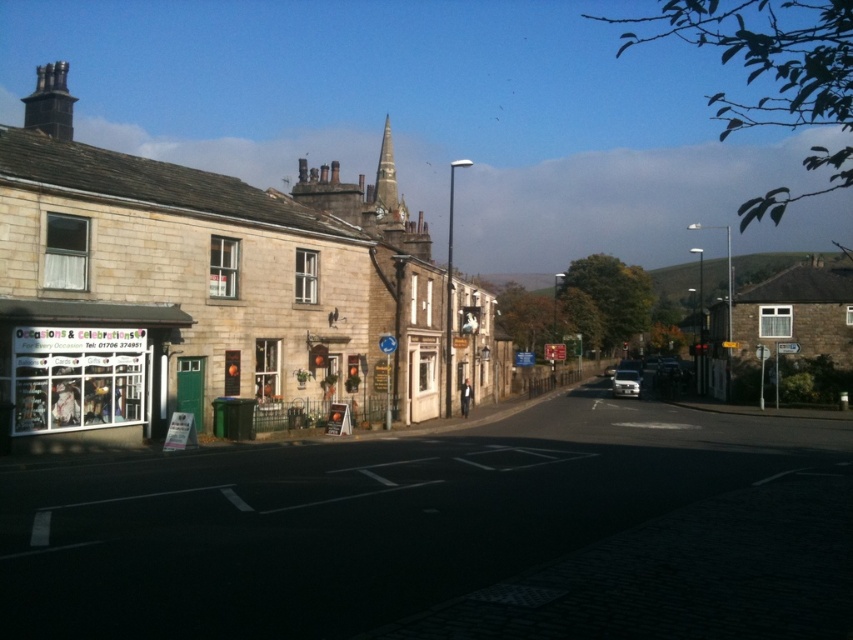
You are a delivery person who needs to deliver a package to the stone building at left. The package is too big to fit through the matte glass window at left. Can you deliver it through the main entrance instead?

The stone building at left is larger in size than the matte glass window at left, so the main entrance is likely large enough to accommodate the oversized package.

You are a delivery person trying to deliver a package to the shop with the green door. You see the stone building at left and the matte glass window at left. Which one should you approach to reach the shop?

You should approach the stone building at left because the matte glass window at left is behind it, meaning the shop entrance is likely at the stone building at left.